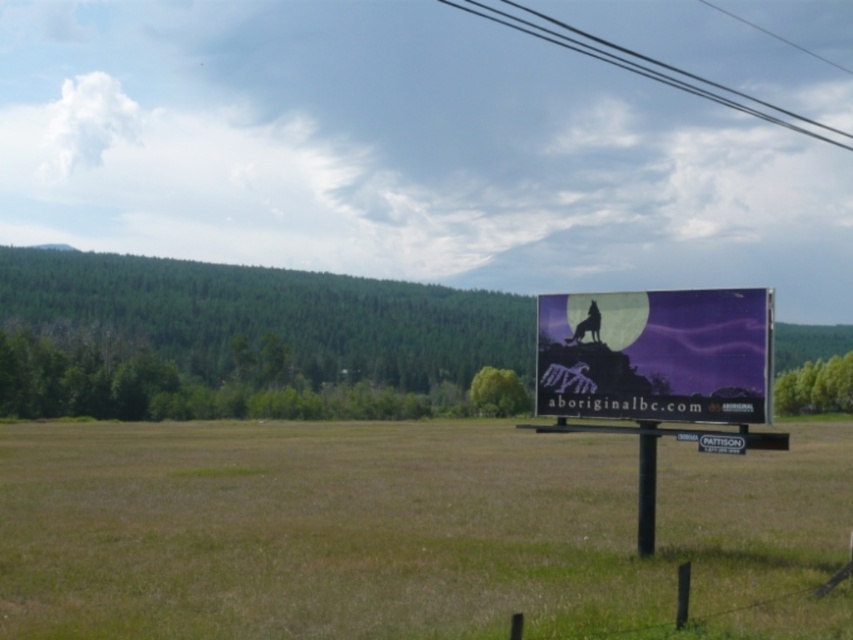
Question: Does black wire at upper center appear on the left side of black plastic pole at center?

Choices:
 (A) yes
 (B) no

Answer: (B)

Question: Which object is farther from the camera taking this photo?

Choices:
 (A) purple glossy billboard at center
 (B) green grassy field at center
 (C) black plastic pole at center
 (D) black wire at upper center

Answer: (D)

Question: Which of the following is the closest to the observer?

Choices:
 (A) (602, 618)
 (B) (573, 314)

Answer: (A)

Question: Observing the image, what is the correct spatial positioning of green grassy field at center in reference to black plastic pole at center?

Choices:
 (A) left
 (B) right

Answer: (B)

Question: Which point is farther to the camera?

Choices:
 (A) black plastic pole at center
 (B) black wire at upper center

Answer: (B)

Question: Where is purple glossy billboard at center located in relation to black plastic pole at center in the image?

Choices:
 (A) right
 (B) left

Answer: (A)